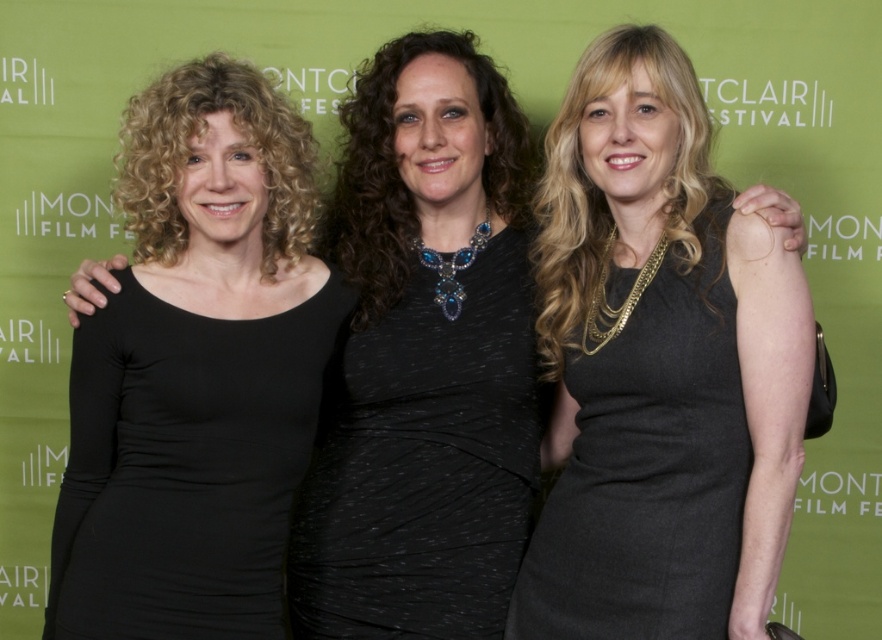
You are a photographer at the Montco Festival. You need to adjust the lighting so that the black matte dress at center and the black textured dress at center are both visible. Which dress should you focus on first to ensure proper exposure?

The black matte dress at center is closer to the viewer than the black textured dress at center, so you should focus on the black matte dress at center first to ensure proper exposure.

You are a fashion stylist trying to decide which dress to recommend to a client for a festival event. The client wants to know which dress is placed lower on the body between the black textured dress at center and the matte black dress at center. Which one should you suggest?

The black textured dress at center is positioned under the matte black dress at center, so it is placed lower on the body. You should suggest the black textured dress at center.

You are standing at the festival and want to take a photo of the black matte dress at center. If your camera can focus up to 5 feet, will you be able to capture it clearly?

The distance between the black matte dress at center and the viewer is 4.79 feet, which is within the camera focus range of up to 5 feet. Therefore, you can capture it clearly.